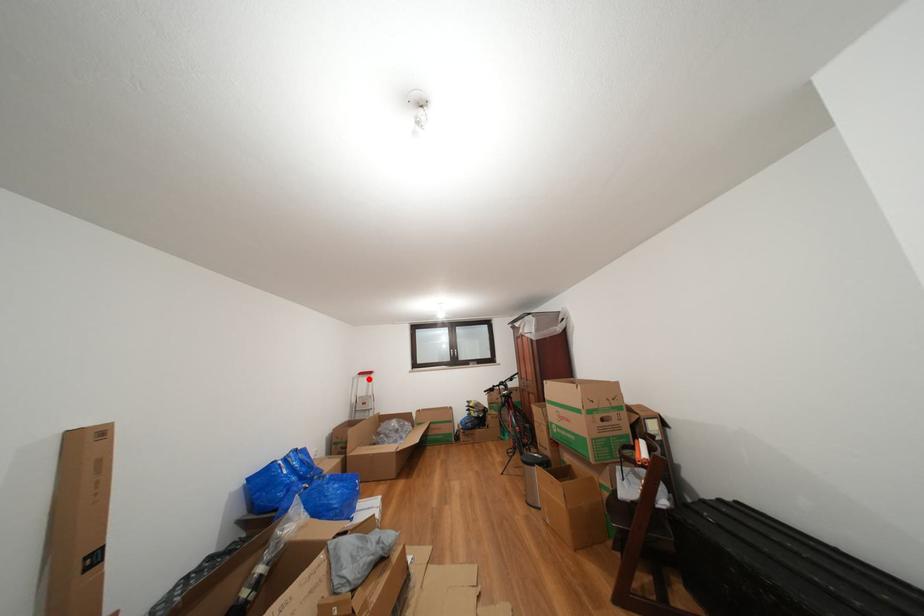
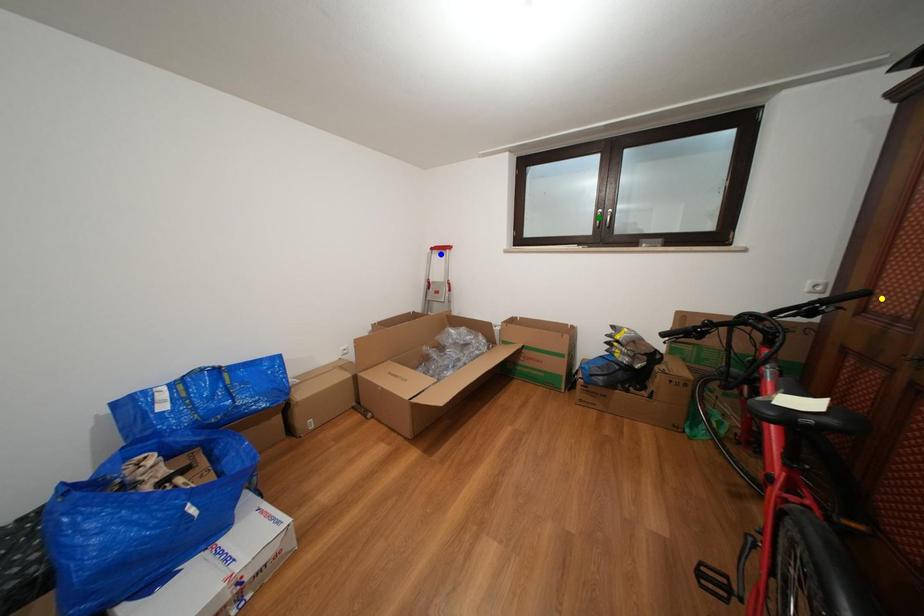
Question: I am providing you with two images of the same scene from different viewpoints. A red point is marked on the first image. You are given multiple points on the second image. In image 2, which mark is for the same physical point as the one in image 1?

Choices:
 (A) yellow point
 (B) green point
 (C) blue point

Answer: (C)